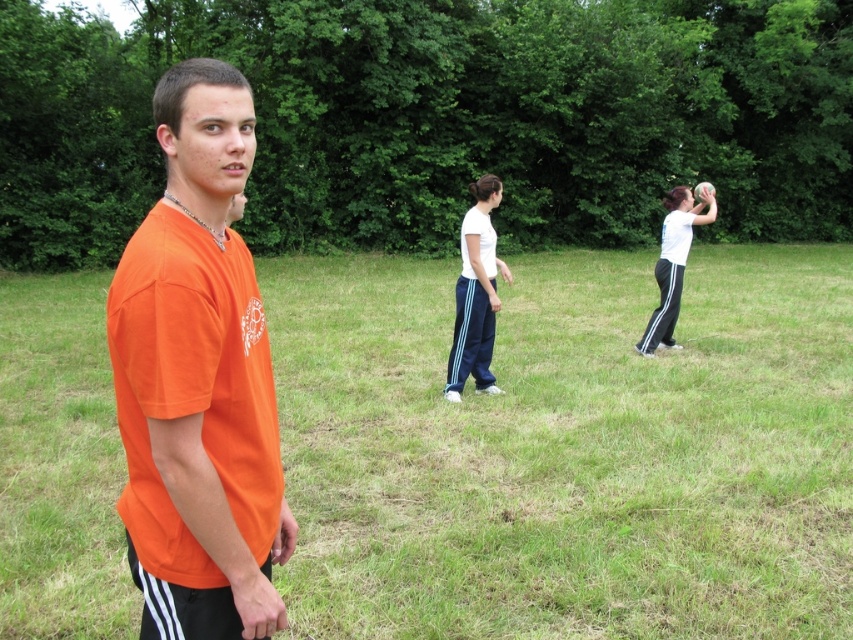
Does orange t-shirt at left come in front of white matte shirt at center?

Yes, it is.

Can you confirm if orange t-shirt at left is positioned to the left of white matte shirt at center?

Correct, you'll find orange t-shirt at left to the left of white matte shirt at center.

The width and height of the screenshot is (853, 640). Find the location of `orange t-shirt at left`. orange t-shirt at left is located at coordinates (198, 380).

This screenshot has height=640, width=853. Describe the element at coordinates (567, 449) in the screenshot. I see `green grass at center` at that location.

Is green grass at center further to the viewer compared to white matte shirt at center?

No, it is in front of white matte shirt at center.

Does point (775, 493) come closer to viewer compared to point (647, 349)?

Yes.

This screenshot has height=640, width=853. In order to click on green grass at center in this screenshot , I will do `click(567, 449)`.

Looking at this image, between white smooth pants at center and white matte shirt at center, which one appears on the right side from the viewer's perspective?

white matte shirt at center

Can you confirm if white smooth pants at center is positioned above white matte shirt at center?

Yes, white smooth pants at center is above white matte shirt at center.

Image resolution: width=853 pixels, height=640 pixels. What do you see at coordinates (476, 292) in the screenshot? I see `white smooth pants at center` at bounding box center [476, 292].

At what (x,y) coordinates should I click in order to perform the action: click on white smooth pants at center. Please return your answer as a coordinate pair (x, y). Looking at the image, I should click on (476, 292).